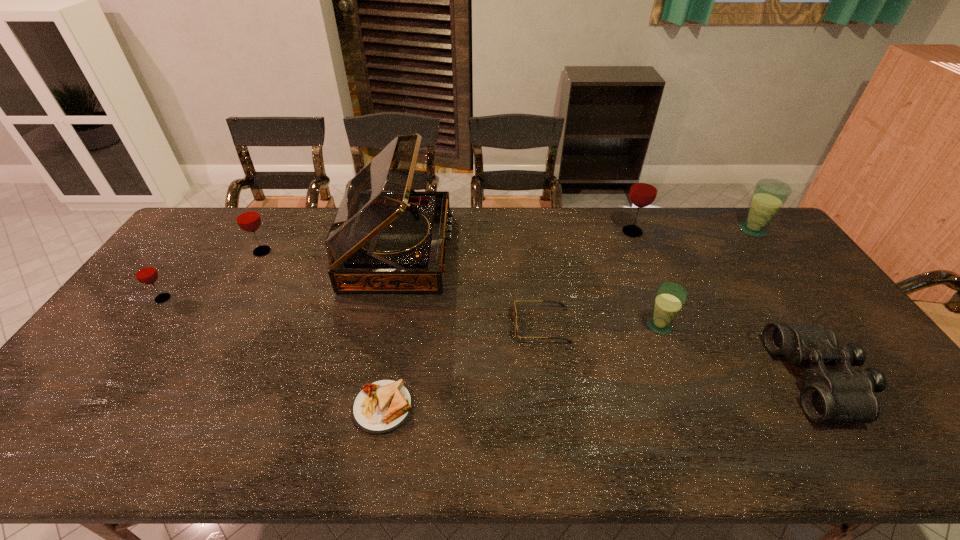
Identify the location of the nearer blue glass. The width and height of the screenshot is (960, 540). (670, 298).

The height and width of the screenshot is (540, 960). In order to click on black binoculars in this screenshot , I will do `click(843, 395)`.

I want to click on binoculars, so click(843, 395).

At what (x,y) coordinates should I click in order to perform the action: click on the eighth tallest object. Please return your answer as a coordinate pair (x, y). The image size is (960, 540). Looking at the image, I should click on (515, 313).

Identify the location of black sunglasses. The height and width of the screenshot is (540, 960). (515, 313).

I want to click on sandwich, so click(x=380, y=407).

In order to click on the shortest object in this screenshot , I will do `click(380, 407)`.

At what (x,y) coordinates should I click in order to perform the action: click on free space located on the front-facing side of the record player. Please return your answer as a coordinate pair (x, y). This screenshot has width=960, height=540. Looking at the image, I should click on (514, 250).

The height and width of the screenshot is (540, 960). In order to click on free region located 0.370m on the front of the rightmost red glass in this screenshot , I will do `click(668, 320)`.

Find the location of a particular element. free space located 0.110m on the left of the right blue glass is located at coordinates (707, 230).